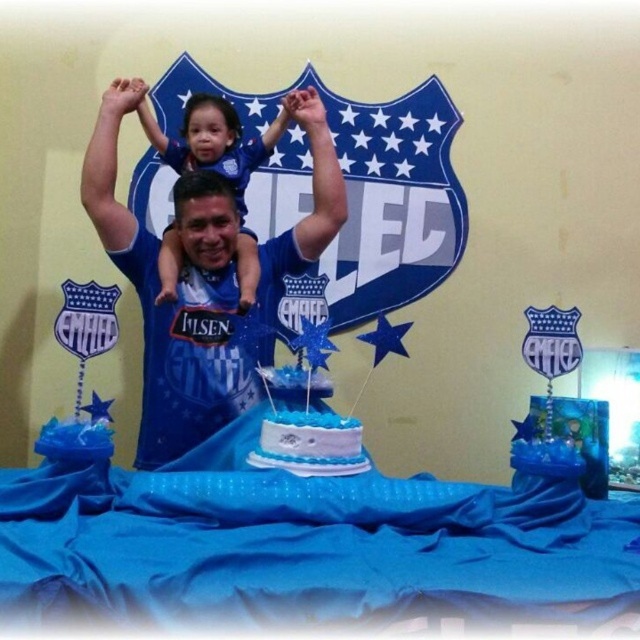
Can you confirm if blue jersey at center is positioned below white frosted cake at center?

Incorrect, blue jersey at center is not positioned below white frosted cake at center.

Between point (186, 368) and point (285, 445), which one is positioned in front?

Point (285, 445)

This screenshot has height=640, width=640. What do you see at coordinates (177, 294) in the screenshot?
I see `blue jersey at center` at bounding box center [177, 294].

This screenshot has height=640, width=640. I want to click on blue jersey at center, so click(177, 294).

Can you confirm if matte blue shirt at center is positioned above white frosted cake at center?

Indeed, matte blue shirt at center is positioned over white frosted cake at center.

At what (x,y) coordinates should I click in order to perform the action: click on matte blue shirt at center. Please return your answer as a coordinate pair (x, y). Looking at the image, I should click on (220, 163).

Find the location of a particular element. matte blue shirt at center is located at coordinates (220, 163).

The height and width of the screenshot is (640, 640). Find the location of `matte blue shirt at center`. matte blue shirt at center is located at coordinates (220, 163).

Is point (170, 326) positioned behind point (198, 161)?

No, it is in front of (198, 161).

Is blue jersey at center to the right of matte blue shirt at center from the viewer's perspective?

Indeed, blue jersey at center is positioned on the right side of matte blue shirt at center.

The image size is (640, 640). I want to click on blue jersey at center, so click(177, 294).

The width and height of the screenshot is (640, 640). Find the location of `blue jersey at center`. blue jersey at center is located at coordinates (177, 294).